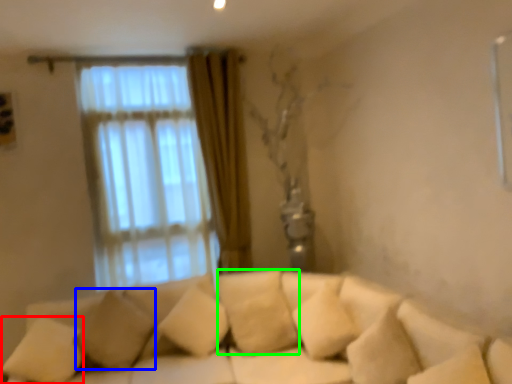
Question: Considering the real-world distances, which object is closest to pillow (highlighted by a red box)? pillow (highlighted by a blue box) or pillow (highlighted by a green box).

Choices:
 (A) pillow
 (B) pillow

Answer: (A)